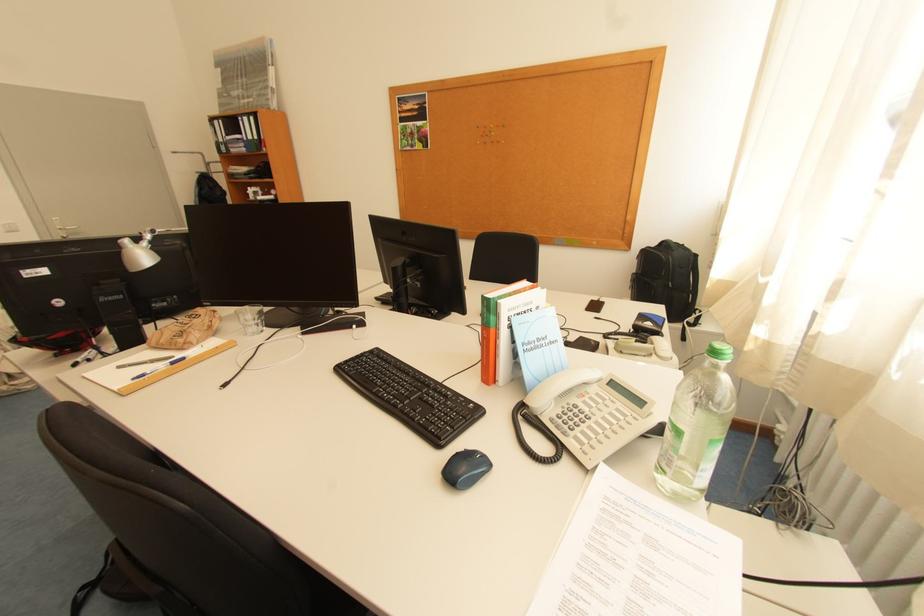
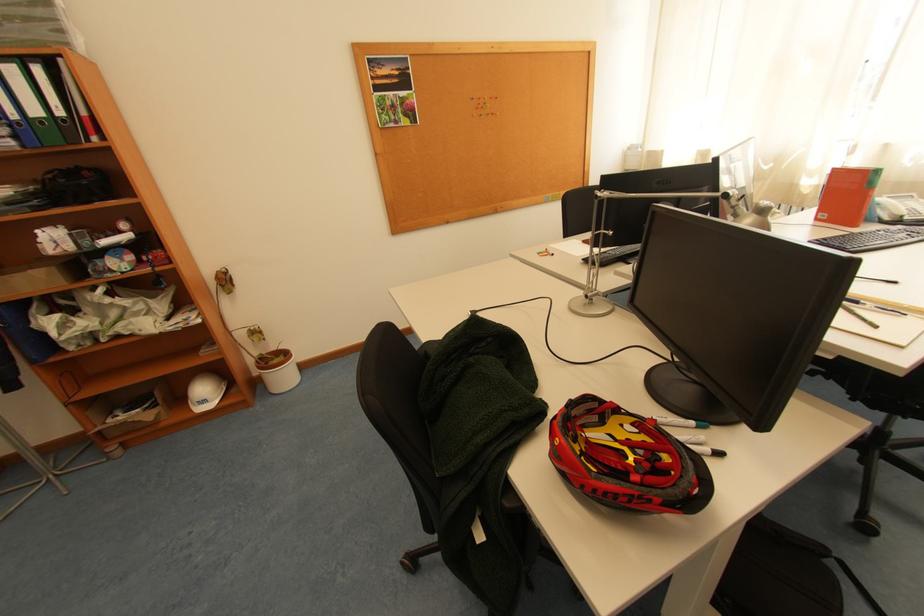
In the second image, find the point that corresponds to point 258,138 in the first image.

(44, 113)